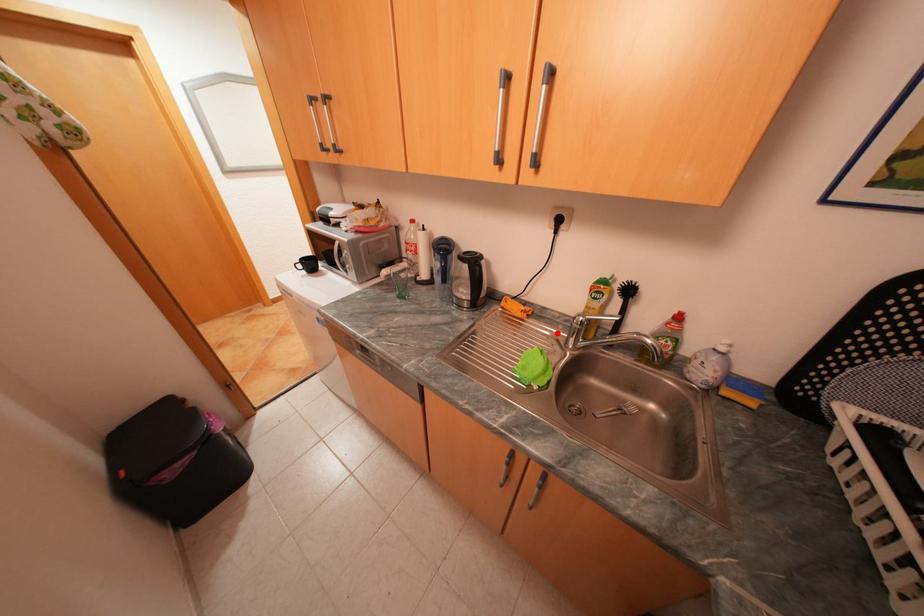
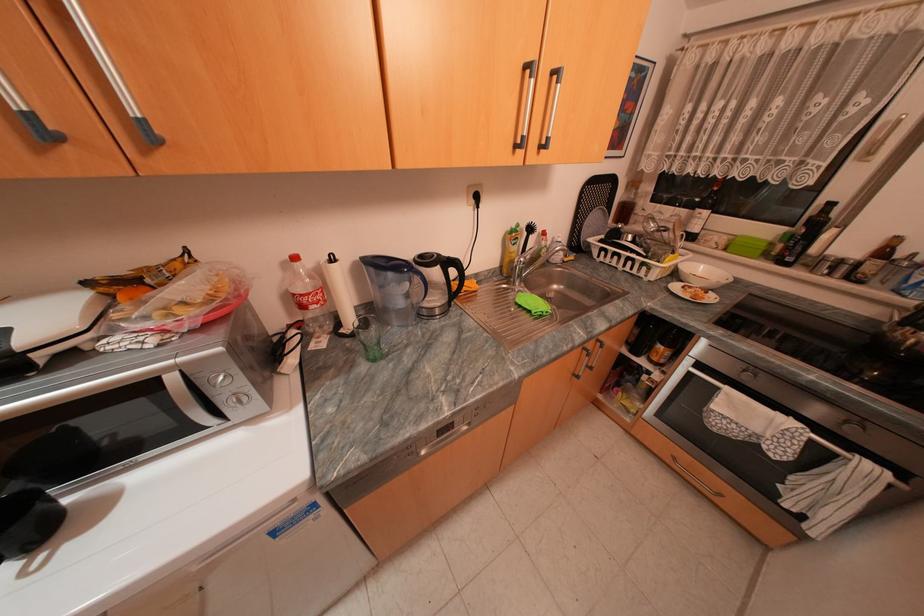
Where in the second image is the point corresponding to the highlighted location from the first image?

(514, 285)